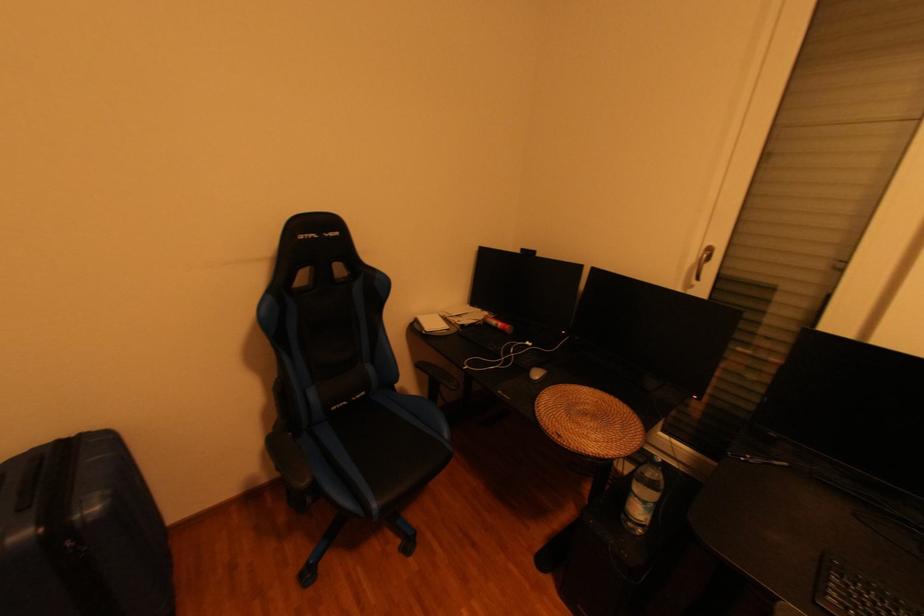
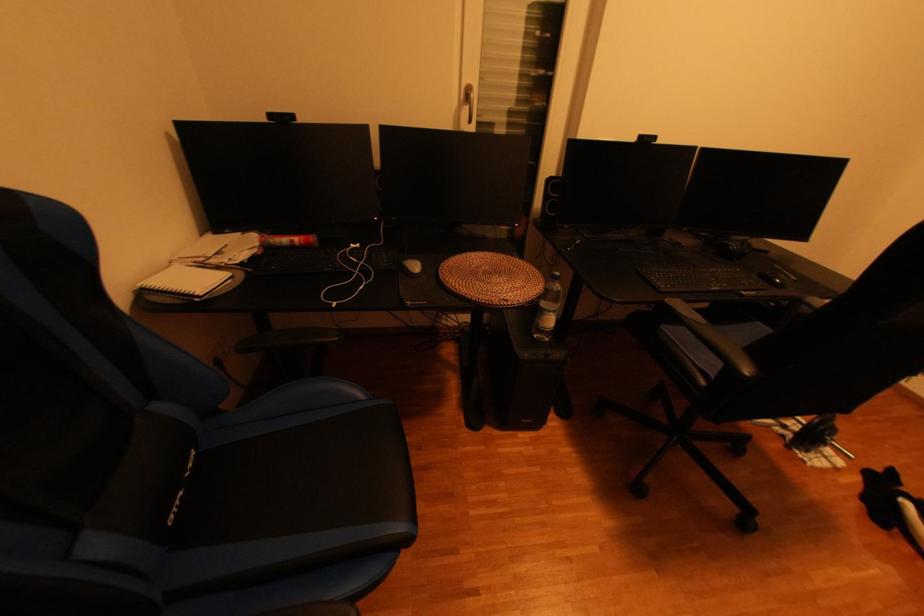
In the second image, find the point that corresponds to pixel 535 342 in the first image.

(359, 246)